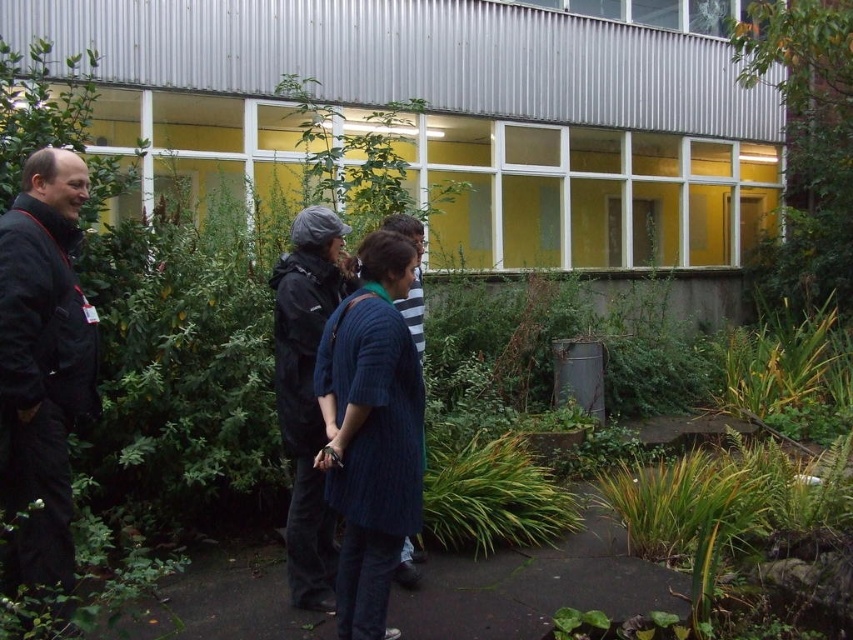
Who is positioned more to the right, black matte jacket at left or green leafy plant at lower center?

Positioned to the right is green leafy plant at lower center.

Which is in front, point (48, 276) or point (554, 490)?

Point (48, 276)

The width and height of the screenshot is (853, 640). Identify the location of black matte jacket at left. (42, 365).

Which is in front, point (318, 288) or point (456, 541)?

Positioned in front is point (318, 288).

Identify the location of dark gray hooded jacket at center. (306, 394).

Is cable-knit sweater at center positioned behind dark gray hooded jacket at center?

That is False.

Who is positioned more to the right, cable-knit sweater at center or dark gray hooded jacket at center?

cable-knit sweater at center is more to the right.

You are a GUI agent. You are given a task and a screenshot of the screen. Output one action in this format:
    pyautogui.click(x=<x>, y=<y>)
    Task: Click on the cable-knit sweater at center
    Image resolution: width=853 pixels, height=640 pixels.
    Given the screenshot: What is the action you would take?
    pyautogui.click(x=370, y=432)